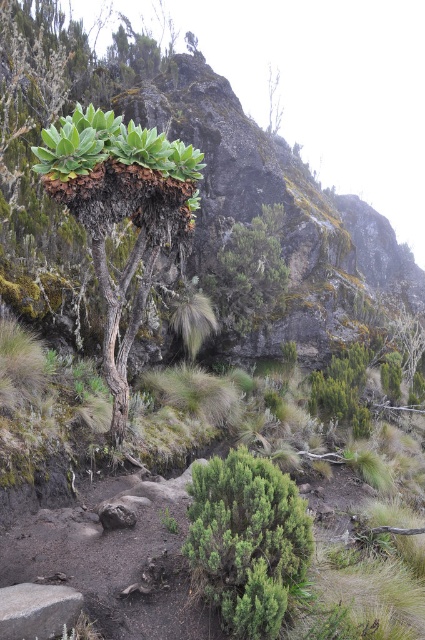
Is green leafy bush at center positioned before gray rock at lower left?

No, green leafy bush at center is behind gray rock at lower left.

Between point (215, 541) and point (31, 609), which one is positioned behind?

The point (215, 541) is more distant.

Between point (209, 515) and point (39, 612), which one is positioned behind?

Positioned behind is point (209, 515).

Where is `green leafy bush at center`? This screenshot has height=640, width=425. green leafy bush at center is located at coordinates (246, 540).

Is point (158, 237) positioned behind point (65, 612)?

Yes, it is.

Can you confirm if green leafy plant at center is positioned to the left of gray rock at lower left?

In fact, green leafy plant at center is to the right of gray rock at lower left.

Image resolution: width=425 pixels, height=640 pixels. Describe the element at coordinates (121, 212) in the screenshot. I see `green leafy plant at center` at that location.

Where is `green leafy plant at center`? Image resolution: width=425 pixels, height=640 pixels. green leafy plant at center is located at coordinates (121, 212).

Can you confirm if green leafy plant at center is positioned to the left of green leafy bush at center?

Yes, green leafy plant at center is to the left of green leafy bush at center.

Between point (76, 148) and point (294, 512), which one is positioned in front?

Positioned in front is point (294, 512).

Between point (133, 314) and point (300, 518), which one is positioned in front?

Point (300, 518) is in front.

What are the coordinates of `green leafy plant at center` in the screenshot? It's located at (121, 212).